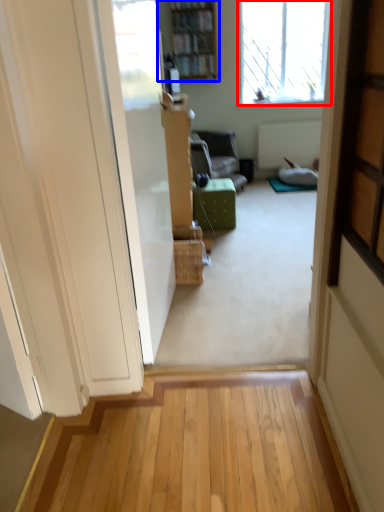
Question: Which point is closer to the camera, window (highlighted by a red box) or bookcase (highlighted by a blue box)?

Choices:
 (A) window
 (B) bookcase

Answer: (B)